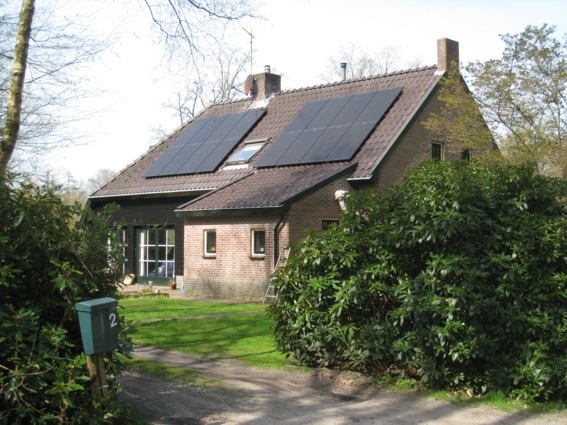
The height and width of the screenshot is (425, 567). Find the location of `window`. window is located at coordinates (257, 245).